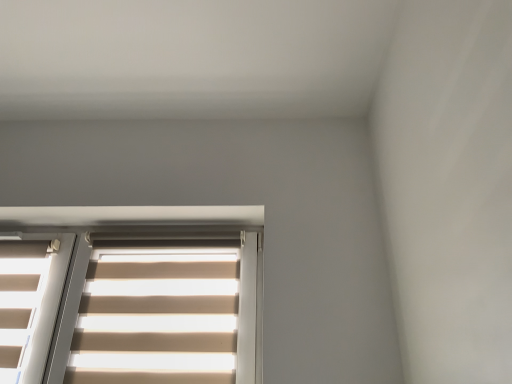
Describe the element at coordinates (157, 317) in the screenshot. I see `beige fabric blind at lower left` at that location.

Where is `beige fabric blind at lower left`? This screenshot has width=512, height=384. beige fabric blind at lower left is located at coordinates [x=157, y=317].

In order to click on beige fabric blind at lower left in this screenshot , I will do `click(157, 317)`.